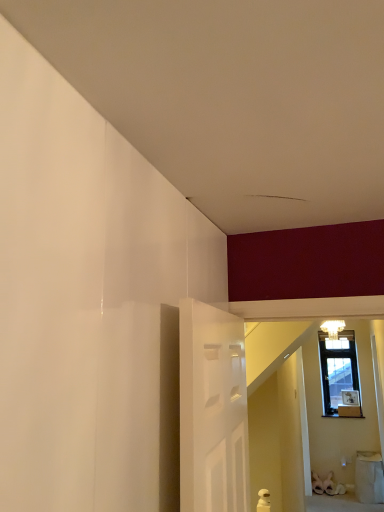
Question: Considering the positions of white fabric laundry basket at lower right and matte white chandelier at upper center in the image, is white fabric laundry basket at lower right taller or shorter than matte white chandelier at upper center?

Choices:
 (A) short
 (B) tall

Answer: (B)

Question: Relative to matte white chandelier at upper center, is white fabric laundry basket at lower right in front or behind?

Choices:
 (A) behind
 (B) front

Answer: (A)

Question: Is white fabric laundry basket at lower right bigger or smaller than matte white chandelier at upper center?

Choices:
 (A) big
 (B) small

Answer: (A)

Question: Do you think matte white chandelier at upper center is within white fabric laundry basket at lower right, or outside of it?

Choices:
 (A) inside
 (B) outside

Answer: (B)

Question: From the image's perspective, relative to white fabric laundry basket at lower right, is matte white chandelier at upper center above or below?

Choices:
 (A) below
 (B) above

Answer: (B)

Question: Is matte white chandelier at upper center taller or shorter than white fabric laundry basket at lower right?

Choices:
 (A) short
 (B) tall

Answer: (A)

Question: Visually, is matte white chandelier at upper center positioned to the left or to the right of white fabric laundry basket at lower right?

Choices:
 (A) right
 (B) left

Answer: (B)